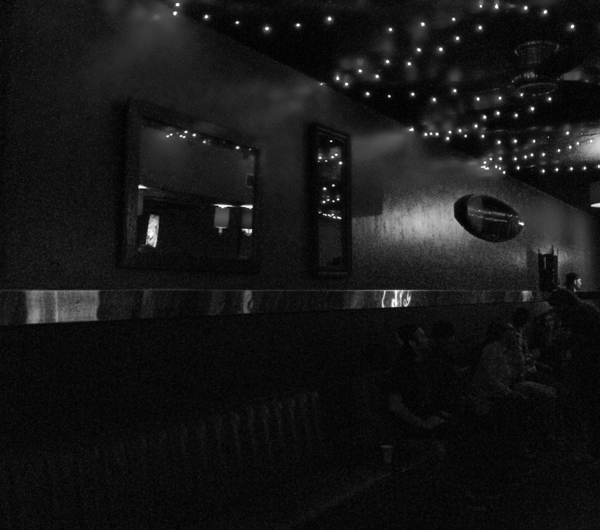
The height and width of the screenshot is (530, 600). In order to click on mirrors in this screenshot , I will do `click(208, 256)`, `click(338, 204)`.